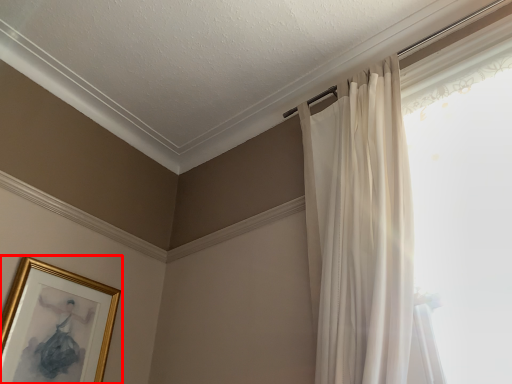
Question: From the image's perspective, considering the relative positions of picture frame (annotated by the red box) and curtain in the image provided, where is picture frame (annotated by the red box) located with respect to the staircase?

Choices:
 (A) below
 (B) above

Answer: (A)